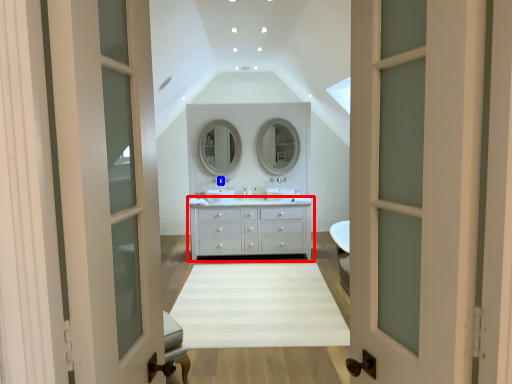
Question: Which object is further to the camera taking this photo, chest of drawers (highlighted by a red box) or faucet (highlighted by a blue box)?

Choices:
 (A) chest of drawers
 (B) faucet

Answer: (B)